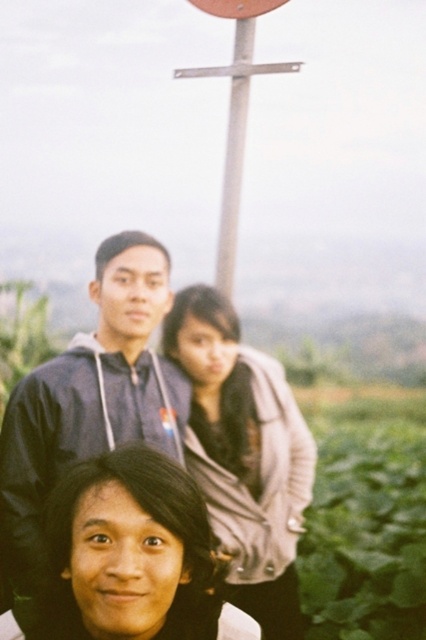
Question: Among these objects, which one is farthest from the camera?

Choices:
 (A) light brown leather jacket at center
 (B) brushed metal sign at upper center
 (C) dark blue hoodie at upper center

Answer: (B)

Question: Among these objects, which one is nearest to the camera?

Choices:
 (A) dark blue hoodie at upper center
 (B) brushed metal sign at upper center

Answer: (A)

Question: Is dark blue hoodie at upper center wider than light brown leather jacket at center?

Choices:
 (A) yes
 (B) no

Answer: (B)

Question: Which object is positioned farthest from the dark blue hoodie at upper center?

Choices:
 (A) metallic pole at center
 (B) light brown leather jacket at center
 (C) brushed metal sign at upper center

Answer: (C)

Question: Does dark blue hoodie at upper center lie behind light brown leather jacket at center?

Choices:
 (A) no
 (B) yes

Answer: (A)

Question: Is dark blue hoodie at upper center above brushed metal sign at upper center?

Choices:
 (A) yes
 (B) no

Answer: (B)